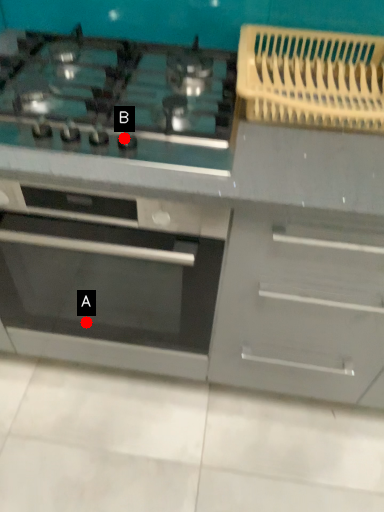
Question: Two points are circled on the image, labeled by A and B beside each circle. Which point is closer to the camera taking this photo?

Choices:
 (A) A is closer
 (B) B is closer

Answer: (B)